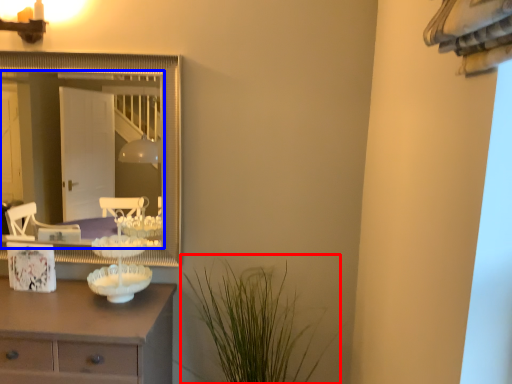
Question: Which object is closer to the camera taking this photo, plant (highlighted by a red box) or mirror (highlighted by a blue box)?

Choices:
 (A) plant
 (B) mirror

Answer: (A)